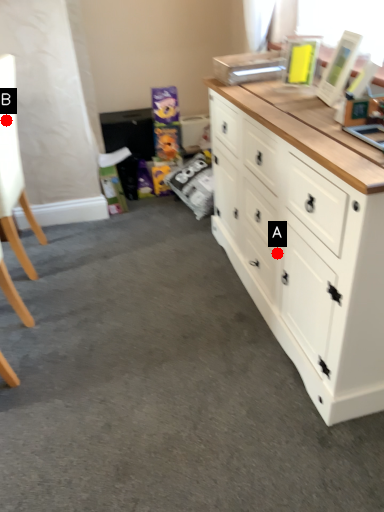
Question: Two points are circled on the image, labeled by A and B beside each circle. Which of the following is the closest to the observer?

Choices:
 (A) A is closer
 (B) B is closer

Answer: (A)